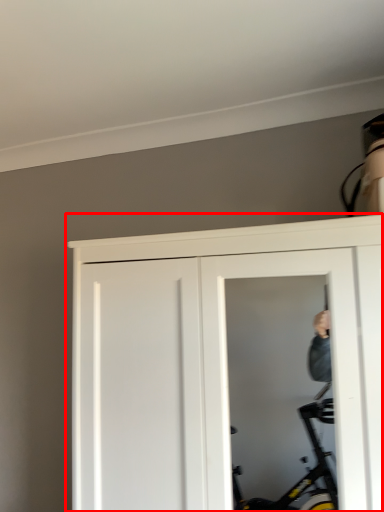
Question: From the image's perspective, what is the correct spatial relationship of door (annotated by the red box) in relation to screen door?

Choices:
 (A) below
 (B) above

Answer: (A)